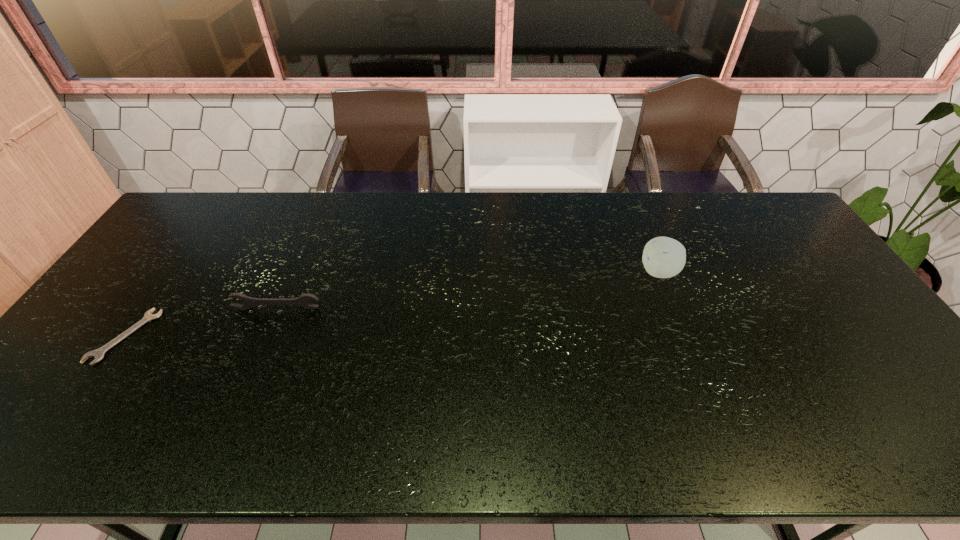
Where is `the rightmost object`? The height and width of the screenshot is (540, 960). the rightmost object is located at coordinates (663, 257).

The width and height of the screenshot is (960, 540). What are the coordinates of `apple` in the screenshot? It's located at (663, 257).

Where is `the second object from left to right`? the second object from left to right is located at coordinates (302, 301).

I want to click on the taller wrench, so (x=302, y=301).

Where is `the left wrench`? the left wrench is located at coordinates (98, 354).

At what (x,y) coordinates should I click in order to perform the action: click on the shortest object. Please return your answer as a coordinate pair (x, y). This screenshot has width=960, height=540. Looking at the image, I should click on tap(98, 354).

At what (x,y) coordinates should I click in order to perform the action: click on vacant area situated 0.150m on the left of the apple. Please return your answer as a coordinate pair (x, y). Looking at the image, I should click on (591, 272).

Locate an element on the screen. The width and height of the screenshot is (960, 540). vacant region located on the open ends of the taller wrench is located at coordinates (262, 345).

In order to click on free spot located on the right of the leftmost object in this screenshot , I will do `click(224, 336)`.

This screenshot has width=960, height=540. I want to click on object that is positioned at the left edge, so click(98, 354).